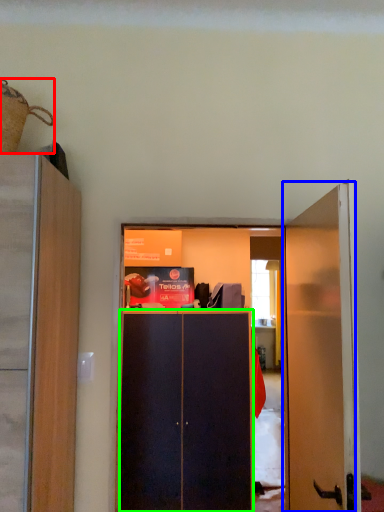
Question: Which is farther away from houseplant (highlighted by a red box)? door (highlighted by a blue box) or screen door (highlighted by a green box)?

Choices:
 (A) door
 (B) screen door

Answer: (B)